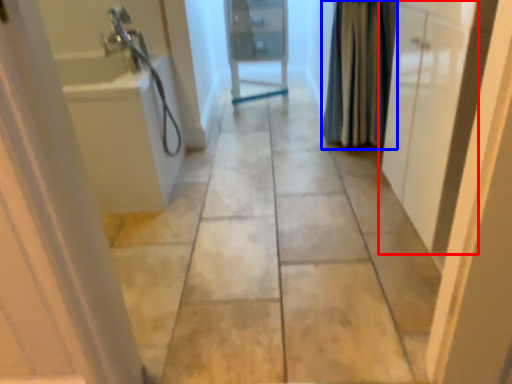
Question: Which object is closer to the camera taking this photo, door (highlighted by a red box) or shower curtain (highlighted by a blue box)?

Choices:
 (A) door
 (B) shower curtain

Answer: (A)